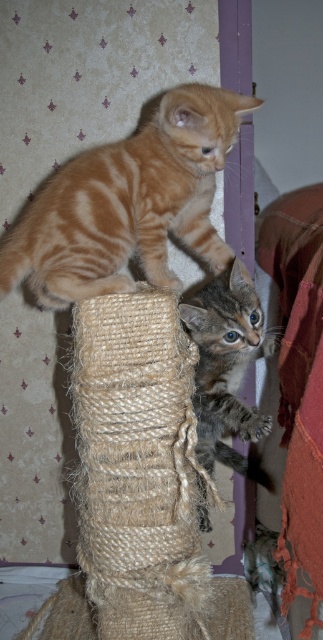
You are a cat owner trying to place a toy between the two points, point (44, 250) and point (197, 435). Which point should you place the toy closer to in order to make it more visible to you?

You should place the toy closer to point (44, 250) because it is closer to the viewer than point (197, 435), making it more visible.

You are a cat owner trying to separate your two kittens. You want to move the orange striped kitten at upper left away from the tabby fur cat at center. Which kitten should you approach first to create space between them?

You should approach the orange striped kitten at upper left first since it is in front of the tabby fur cat at center, making it easier to move it away to create space between them.

You are a cat owner who wants to place a new toy for your orange striped kitten at upper left. The toy must be placed exactly at point (128, 204). Is this point where the kitten is currently located?

Yes, the orange striped kitten at upper left is exactly at point (128, 204).